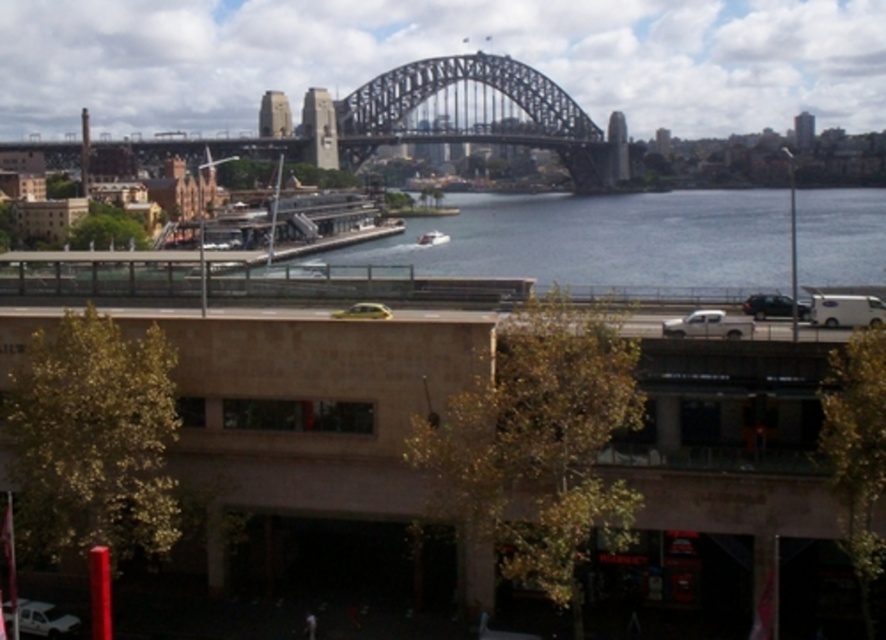
You are standing in front of the multi level building with beige facade and large windows. You see a shiny black sedan at center and a white plastic boat at center. Which object is nearer to you?

The shiny black sedan at center is closer to the viewer than the white plastic boat at center.

You are standing at the point with coordinates 0,0. You want to go to the shiny black sedan at center. Which direction should you go?

The shiny black sedan at center is located at coordinates (767,305). Since you are at (0,0), you should move northeast to reach it.

You are a pedestrian standing on the sidewalk near the multi level building with beige facade and large windows. You want to take a photo of the Sydney Harbour Bridge while avoiding the white matte truck at right and the white plastic boat at center. Which object is closer to your position so you can step aside to avoid blocking the view?

The white matte truck at right is located below the white plastic boat at center, so it is closer to your position. You should step aside to avoid the white matte truck at right first as it is nearer.